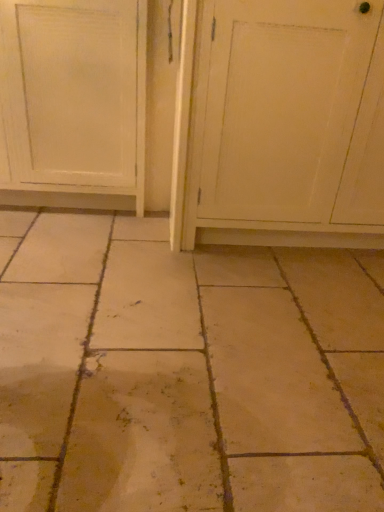
Locate an element on the screen. vacant area that is in front of white wood screen door at center is located at coordinates (273, 324).